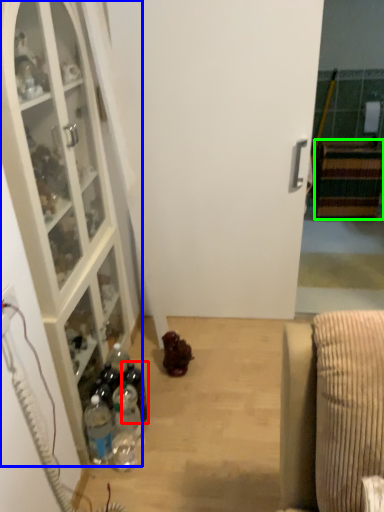
Question: Which is nearer to the bottle (highlighted by a red box)? cabinetry (highlighted by a blue box) or cabinetry (highlighted by a green box).

Choices:
 (A) cabinetry
 (B) cabinetry

Answer: (A)